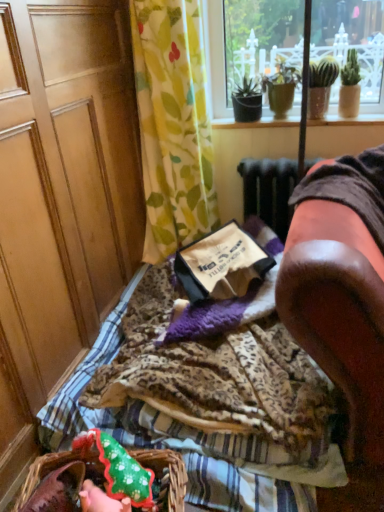
Question: From a real-world perspective, is wooden screen door at left above or below brown paper bag at center?

Choices:
 (A) below
 (B) above

Answer: (B)

Question: Do you think wooden screen door at left is within brown paper bag at center, or outside of it?

Choices:
 (A) outside
 (B) inside

Answer: (A)

Question: Which of these objects is positioned closest to the green floral fabric at upper center?

Choices:
 (A) brown paper bag at center
 (B) green fabric flower basket at lower left
 (C) wooden screen door at left
 (D) brown leather armchair at right
 (E) leopard print fabric at center

Answer: (C)

Question: Which object is the closest to the brown paper bag at center?

Choices:
 (A) wooden screen door at left
 (B) green floral fabric at upper center
 (C) brown leather armchair at right
 (D) leopard print fabric at center
 (E) green fabric flower basket at lower left

Answer: (D)